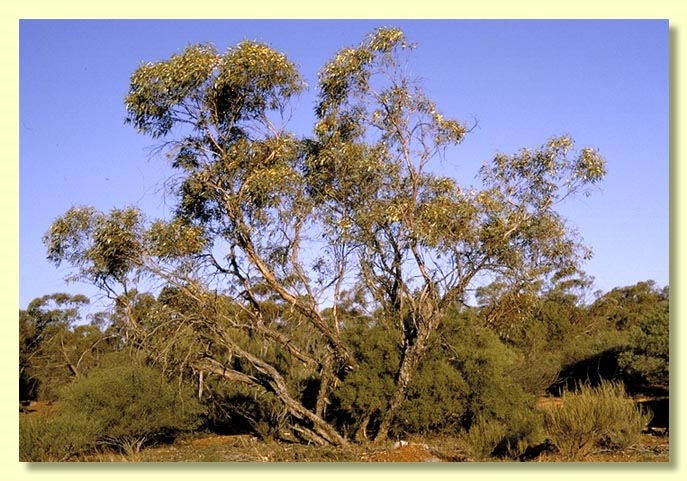
Find the location of `photo on canvas`. photo on canvas is located at coordinates (644, 97).